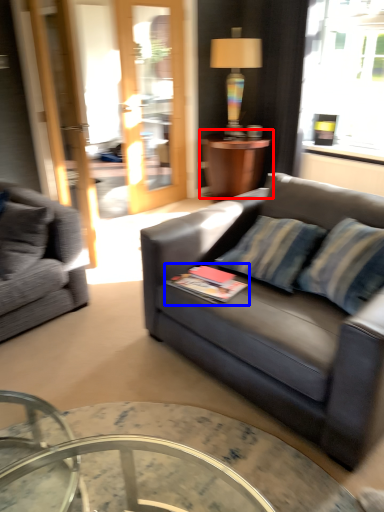
Question: Which of the following is the farthest to the observer, table (highlighted by a red box) or book (highlighted by a blue box)?

Choices:
 (A) table
 (B) book

Answer: (A)